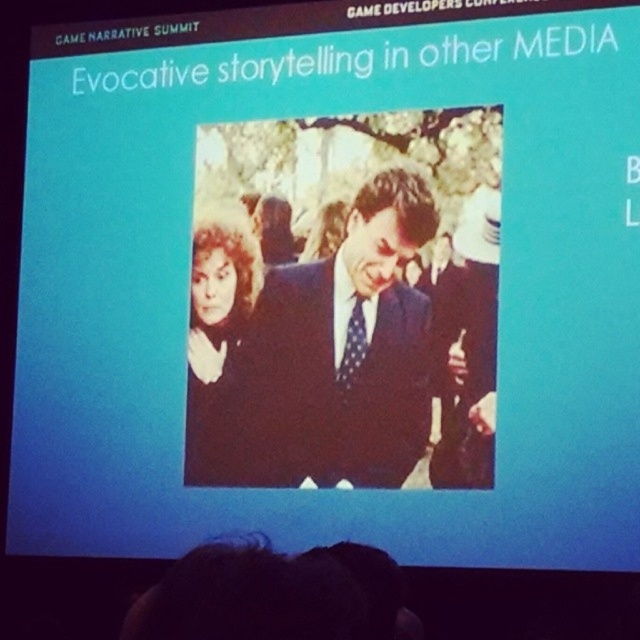
Question: Which object is farther from the camera taking this photo?

Choices:
 (A) dark blue suit at center
 (B) matte black coat at center

Answer: (B)

Question: Is dark blue suit at center below matte black coat at center?

Choices:
 (A) no
 (B) yes

Answer: (A)

Question: Is dark blue suit at center positioned before matte black coat at center?

Choices:
 (A) no
 (B) yes

Answer: (B)

Question: Is dark blue suit at center smaller than matte black coat at center?

Choices:
 (A) no
 (B) yes

Answer: (A)

Question: Among these points, which one is farthest from the camera?

Choices:
 (A) (225, 236)
 (B) (273, 362)

Answer: (A)